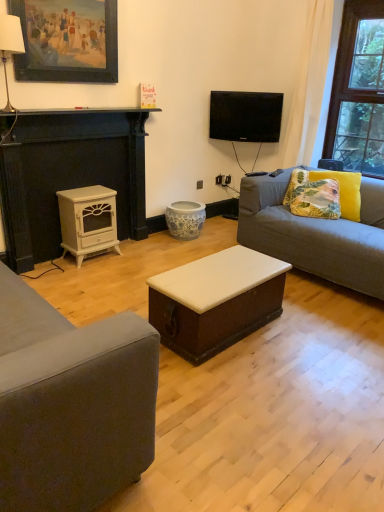
Locate an element on the screen. free space to the right of white painted wood stove at left, placed as the second table when sorted from bottom to top is located at coordinates (134, 258).